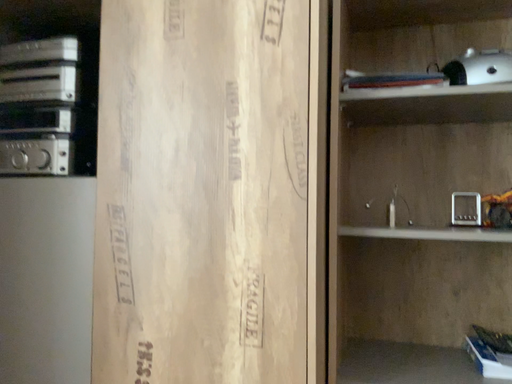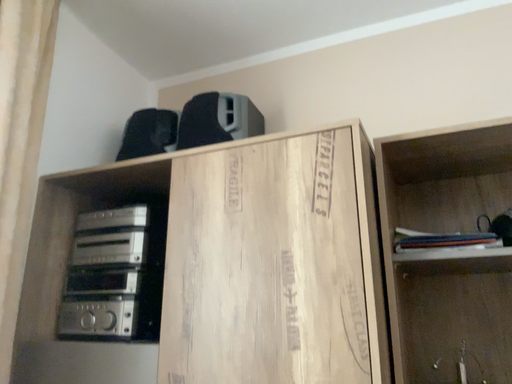
Question: Which way did the camera rotate in the video?

Choices:
 (A) rotated downward
 (B) rotated upward

Answer: (B)